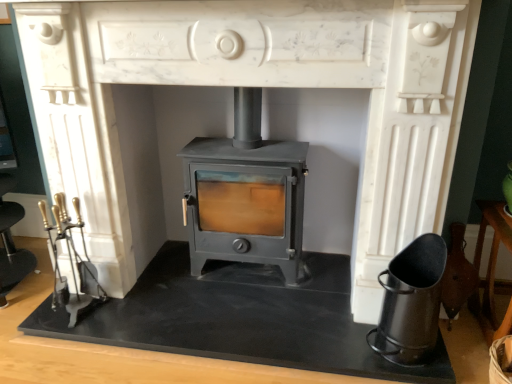
Question: Considering the positions of black slate at center and matte gray wood burning stove at center in the image, is black slate at center taller or shorter than matte gray wood burning stove at center?

Choices:
 (A) tall
 (B) short

Answer: (B)

Question: From a real-world perspective, is black slate at center physically located above or below matte gray wood burning stove at center?

Choices:
 (A) below
 (B) above

Answer: (A)

Question: Considering the real-world distances, which object is farthest from the black matte ash bucket at lower right?

Choices:
 (A) matte gray wood burning stove at center
 (B) black slate at center

Answer: (A)

Question: Estimate the real-world distances between objects in this image. Which object is farther from the black matte ash bucket at lower right?

Choices:
 (A) black slate at center
 (B) matte gray wood burning stove at center

Answer: (B)